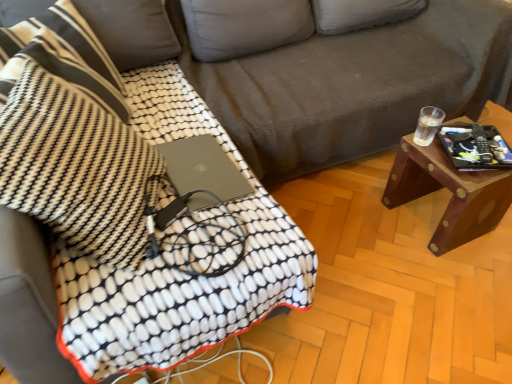
I want to click on vacant region in front of woodenmaterial/texturetable at right, so click(x=450, y=279).